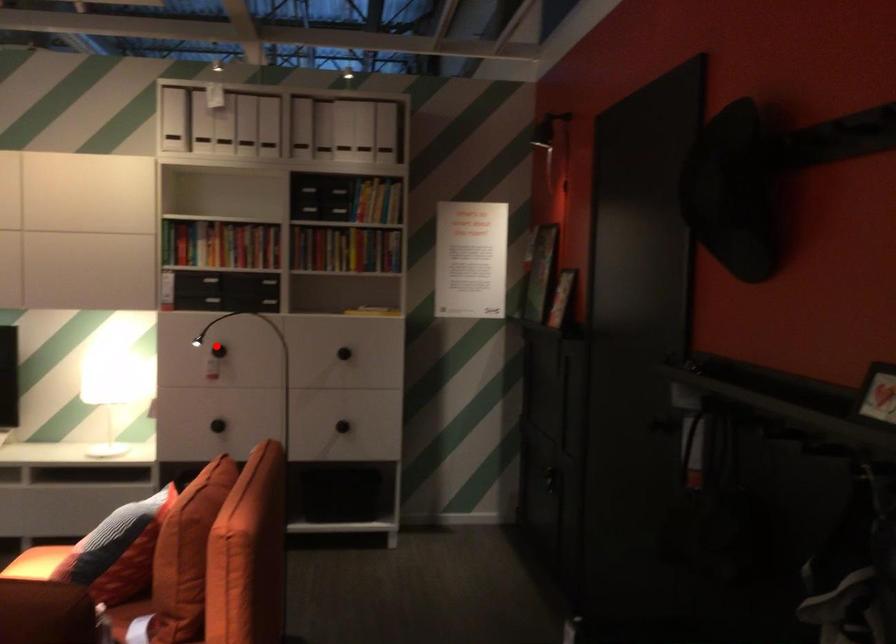
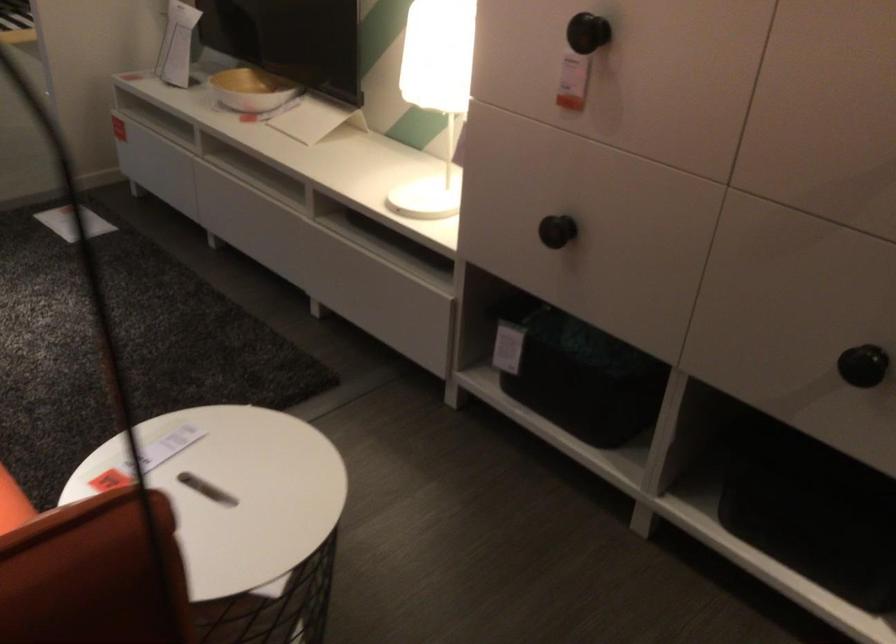
Question: I am providing you with two images of the same scene from different viewpoints. Image1 has a red point marked. In image2, the corresponding 3D location appears at what relative position? Reply with the corresponding letter.

Choices:
 (A) Closer
 (B) Farther

Answer: (A)